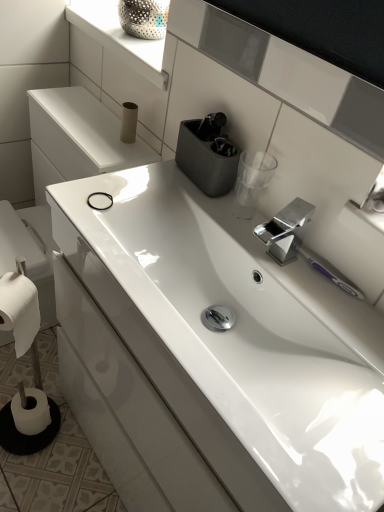
Question: From a real-world perspective, is white matte toilet paper at lower left, placed as the third toilet paper when sorted from right to left, physically located above or below white glossy sink at center?

Choices:
 (A) above
 (B) below

Answer: (B)

Question: Looking at their shapes, would you say white matte toilet paper at lower left, which ranks as the 3th toilet paper in top-to-bottom order, is wider or thinner than white glossy sink at center?

Choices:
 (A) wide
 (B) thin

Answer: (B)

Question: Which object is positioned farthest from the matte cardboard toilet paper at upper center, which is the 1th toilet paper in top-to-bottom order?

Choices:
 (A) white glossy sink at center
 (B) white matte toilet paper at lower left, the third toilet paper from the front
 (C) white matte toilet paper at lower left, placed as the third toilet paper when sorted from back to front
 (D) white glossy window sill at upper center
 (E) polished metallic tap at center

Answer: (B)

Question: Which is farther from the matte cardboard toilet paper at upper center, which is the 1th toilet paper in top-to-bottom order?

Choices:
 (A) white matte toilet paper at lower left, placed as the third toilet paper when sorted from right to left
 (B) white glossy window sill at upper center
 (C) polished metallic tap at center
 (D) white matte toilet paper at lower left, placed as the third toilet paper when sorted from back to front
 (E) white glossy sink at center

Answer: (A)